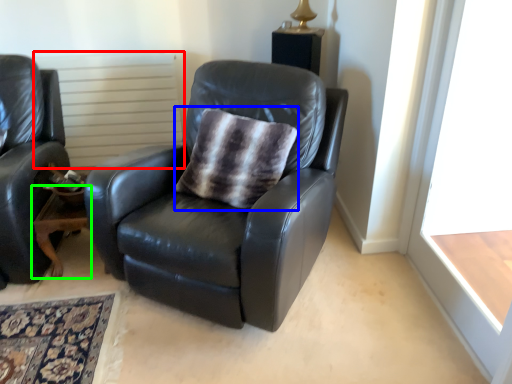
Question: Which is farther away from radiator (highlighted by a red box)? throw pillow (highlighted by a blue box) or table (highlighted by a green box)?

Choices:
 (A) throw pillow
 (B) table

Answer: (A)